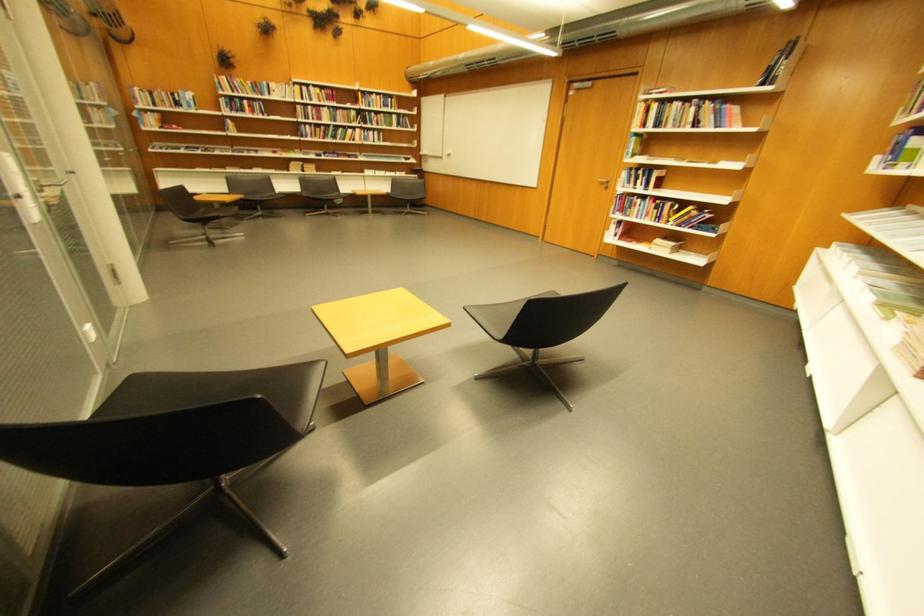
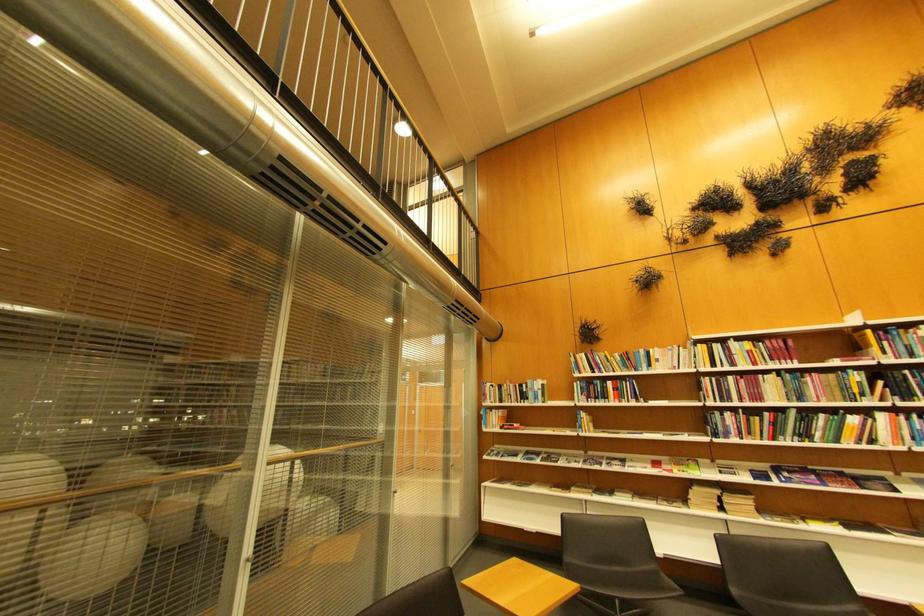
The point at (276, 95) is marked in the first image. Where is the corresponding point in the second image?

(654, 368)